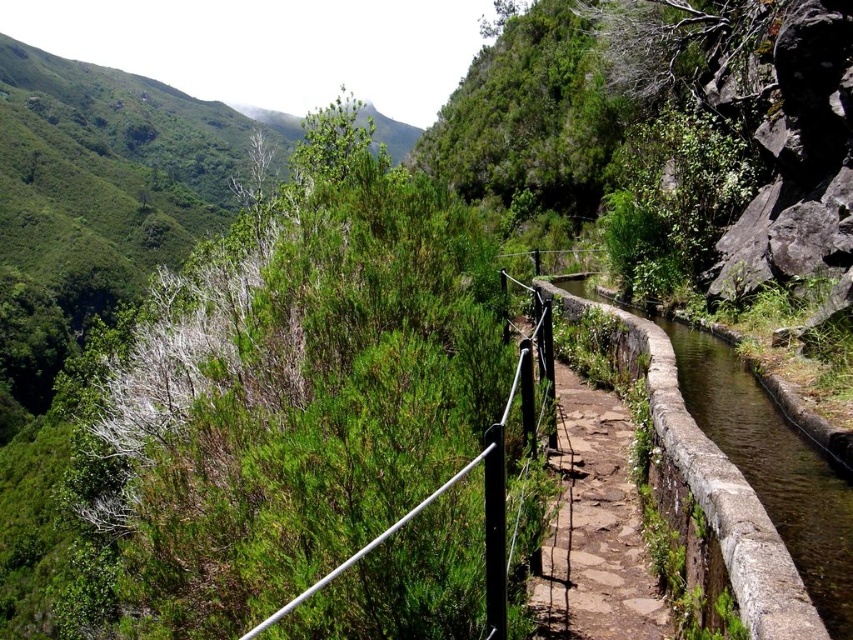
Question: Which object appears farthest from the camera in this image?

Choices:
 (A) brown stone path at center
 (B) black metal rail at upper center

Answer: (A)

Question: Which point is closer to the camera?

Choices:
 (A) (796, 564)
 (B) (640, 516)

Answer: (A)

Question: Is brown stone path at center to the left of smooth stone canal at center from the viewer's perspective?

Choices:
 (A) no
 (B) yes

Answer: (B)

Question: Considering the relative positions of smooth stone canal at center and black metal rail at upper center in the image provided, where is smooth stone canal at center located with respect to black metal rail at upper center?

Choices:
 (A) left
 (B) right

Answer: (B)

Question: Among these objects, which one is nearest to the camera?

Choices:
 (A) black metal rail at upper center
 (B) smooth stone canal at center

Answer: (A)

Question: Does brown stone path at center appear on the left side of black metal rail at upper center?

Choices:
 (A) yes
 (B) no

Answer: (B)